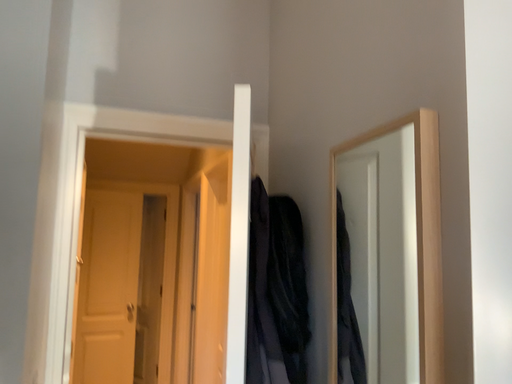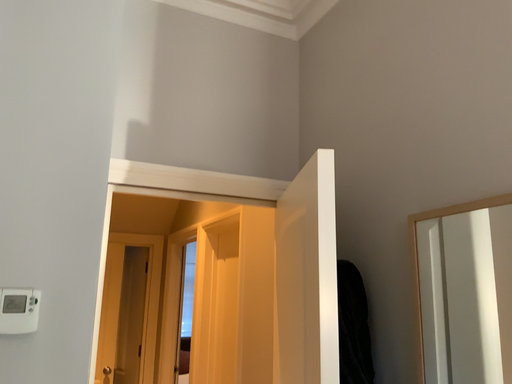
Question: How did the camera likely rotate when shooting the video?

Choices:
 (A) rotated right
 (B) rotated left

Answer: (A)